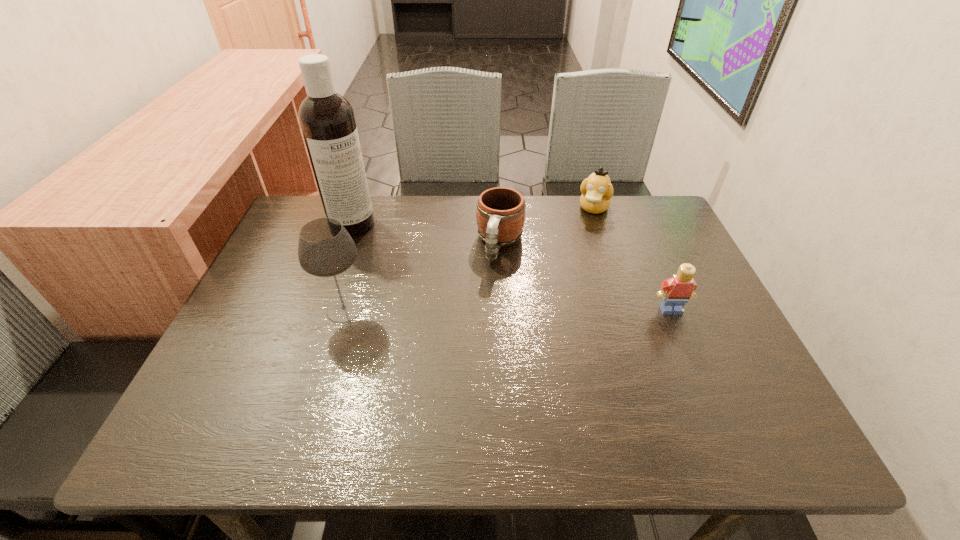
Locate an element on the screen. The image size is (960, 540). vacant space located 0.270m on the side of the third object from right to left with the handle is located at coordinates (471, 349).

The width and height of the screenshot is (960, 540). I want to click on free location located 0.050m on the side of the third object from right to left with the handle, so click(x=492, y=280).

Identify the location of vacant area situated 0.400m on the side of the third object from right to left with the handle. (456, 401).

You are a GUI agent. You are given a task and a screenshot of the screen. Output one action in this format:
    pyautogui.click(x=<x>, y=<y>)
    Task: Click on the blank area located on the face of the duckling
    The height and width of the screenshot is (540, 960).
    Given the screenshot: What is the action you would take?
    pyautogui.click(x=553, y=309)

Locate an element on the screen. This screenshot has height=540, width=960. vacant position located on the face of the duckling is located at coordinates (554, 306).

Find the location of `vacant space situated on the face of the duckling`. vacant space situated on the face of the duckling is located at coordinates (555, 303).

I want to click on dishwasher detergent that is positioned at the far edge, so click(327, 120).

Find the location of a particular element. The image size is (960, 540). mug present at the far edge is located at coordinates (500, 214).

You are a GUI agent. You are given a task and a screenshot of the screen. Output one action in this format:
    pyautogui.click(x=<x>, y=<y>)
    Task: Click on the duckling situated at the far edge
    The width and height of the screenshot is (960, 540).
    Given the screenshot: What is the action you would take?
    pyautogui.click(x=597, y=190)

Where is `object at the left edge`? object at the left edge is located at coordinates (327, 120).